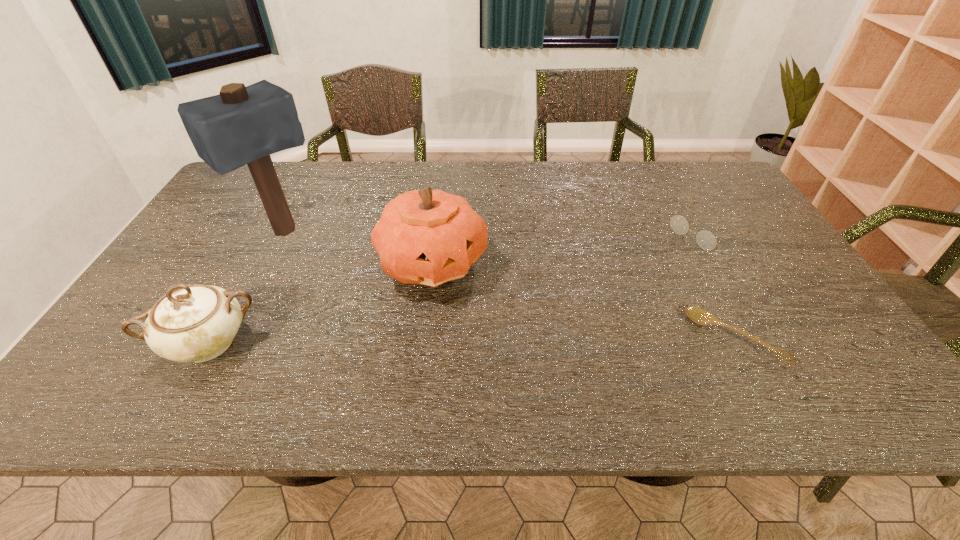
Locate an element on the screen. The width and height of the screenshot is (960, 540). mallet that is at the left edge is located at coordinates (242, 125).

The width and height of the screenshot is (960, 540). Find the location of `ladle situated at the right edge`. ladle situated at the right edge is located at coordinates (698, 315).

This screenshot has width=960, height=540. What are the coordinates of `spectacles that is at the right edge` in the screenshot? It's located at (705, 239).

Find the location of a particular element. This screenshot has height=540, width=960. object situated at the near left corner is located at coordinates (195, 323).

I want to click on object at the near right corner, so click(698, 315).

Image resolution: width=960 pixels, height=540 pixels. Identify the location of blank area at the far edge. (311, 171).

The width and height of the screenshot is (960, 540). In the image, there is a desktop. Identify the location of vacant region at the near edge. (615, 334).

You are a GUI agent. You are given a task and a screenshot of the screen. Output one action in this format:
    pyautogui.click(x=<x>, y=<y>)
    Task: Click on the vacant space at the left edge
    This screenshot has width=960, height=540.
    Given the screenshot: What is the action you would take?
    pyautogui.click(x=231, y=206)

Identify the location of free region at the far left corner. (276, 162).

At what (x,y) coordinates should I click in order to perform the action: click on vacant region at the near right corner of the desktop. Please return your answer as a coordinate pair (x, y). Image resolution: width=960 pixels, height=540 pixels. Looking at the image, I should click on (841, 349).